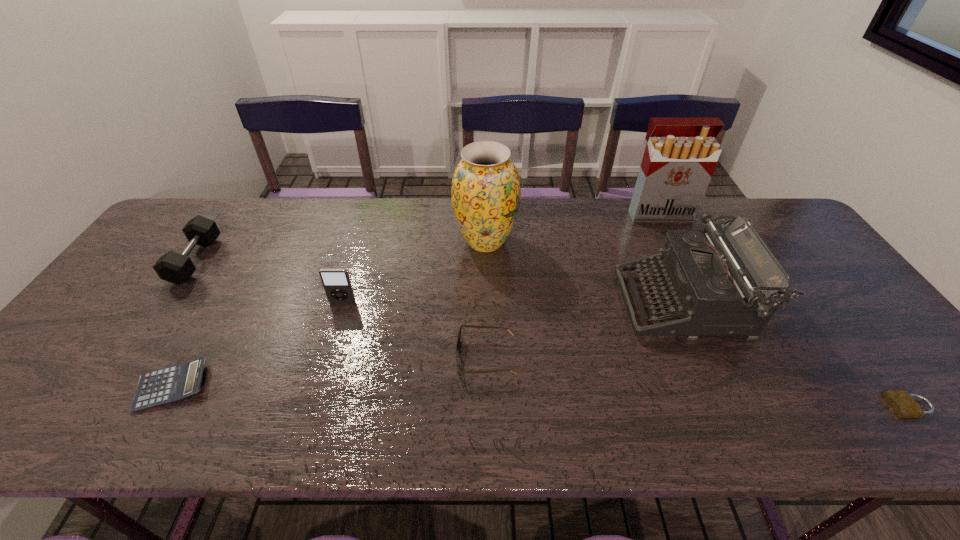
The height and width of the screenshot is (540, 960). What are the coordinates of `the closest object relative to the typewriter` in the screenshot? It's located at (681, 154).

Locate an element on the screen. free space that satisfies the following two spatial constraints: 1. on the front side of the calculator; 2. on the right side of the fifth tallest object is located at coordinates (108, 386).

Find the location of a particular element. vacant area that satisfies the following two spatial constraints: 1. on the back side of the leftmost object; 2. on the left side of the vase is located at coordinates (208, 242).